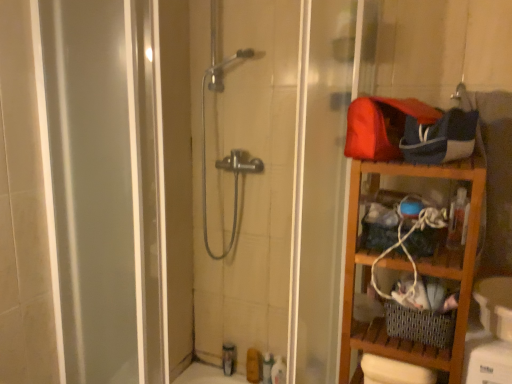
Question: Is matte brown soap at lower center, arranged as the 3th toiletry when viewed from the right, at the right side of translucent plastic toiletries at lower center, which is counted as the 1th toiletry, starting from the left?

Choices:
 (A) no
 (B) yes

Answer: (B)

Question: Considering the relative sizes of matte brown soap at lower center, arranged as the 3th toiletry when viewed from the right, and translucent plastic toiletries at lower center, placed as the fourth toiletry when sorted from right to left, in the image provided, is matte brown soap at lower center, arranged as the 3th toiletry when viewed from the right, shorter than translucent plastic toiletries at lower center, placed as the fourth toiletry when sorted from right to left,?

Choices:
 (A) yes
 (B) no

Answer: (A)

Question: Is matte brown soap at lower center, arranged as the 3th toiletry when viewed from the right, outside translucent plastic toiletries at lower center, which is counted as the 1th toiletry, starting from the left?

Choices:
 (A) yes
 (B) no

Answer: (A)

Question: Are matte brown soap at lower center, arranged as the 3th toiletry when viewed from the right, and translucent plastic toiletries at lower center, which is counted as the 1th toiletry, starting from the left, far apart?

Choices:
 (A) no
 (B) yes

Answer: (A)

Question: Can you confirm if matte brown soap at lower center, arranged as the 3th toiletry when viewed from the right, is taller than translucent plastic toiletries at lower center, which is counted as the 1th toiletry, starting from the left?

Choices:
 (A) yes
 (B) no

Answer: (B)

Question: From a real-world perspective, is matte brown soap at lower center, which is counted as the 2th toiletry, starting from the left, located beneath translucent plastic toiletries at lower center, which is counted as the 1th toiletry, starting from the left?

Choices:
 (A) no
 (B) yes

Answer: (B)

Question: Can you confirm if matte brown soap at lower center, arranged as the 3th toiletry when viewed from the right, is taller than white glossy bottle at lower center, which is the 1th toiletry from right to left?

Choices:
 (A) no
 (B) yes

Answer: (B)

Question: Is matte brown soap at lower center, which is counted as the 2th toiletry, starting from the left, not near white glossy bottle at lower center, the 4th toiletry positioned from the left?

Choices:
 (A) no
 (B) yes

Answer: (A)

Question: Considering the relative sizes of matte brown soap at lower center, which is counted as the 2th toiletry, starting from the left, and white glossy bottle at lower center, which is the 1th toiletry from right to left, in the image provided, is matte brown soap at lower center, which is counted as the 2th toiletry, starting from the left, shorter than white glossy bottle at lower center, which is the 1th toiletry from right to left,?

Choices:
 (A) yes
 (B) no

Answer: (B)

Question: Is white glossy bottle at lower center, which is the 1th toiletry from right to left, a part of matte brown soap at lower center, which is counted as the 2th toiletry, starting from the left?

Choices:
 (A) yes
 (B) no

Answer: (B)

Question: From the image's perspective, would you say matte brown soap at lower center, arranged as the 3th toiletry when viewed from the right, is shown under white glossy bottle at lower center, the 4th toiletry positioned from the left?

Choices:
 (A) yes
 (B) no

Answer: (B)

Question: Is matte brown soap at lower center, which is counted as the 2th toiletry, starting from the left, at the right side of white glossy bottle at lower center, the 4th toiletry positioned from the left?

Choices:
 (A) yes
 (B) no

Answer: (B)

Question: Could you tell me if matte brown soap at lower center, arranged as the 3th toiletry when viewed from the right, is turned towards wooden shelf at right?

Choices:
 (A) no
 (B) yes

Answer: (A)